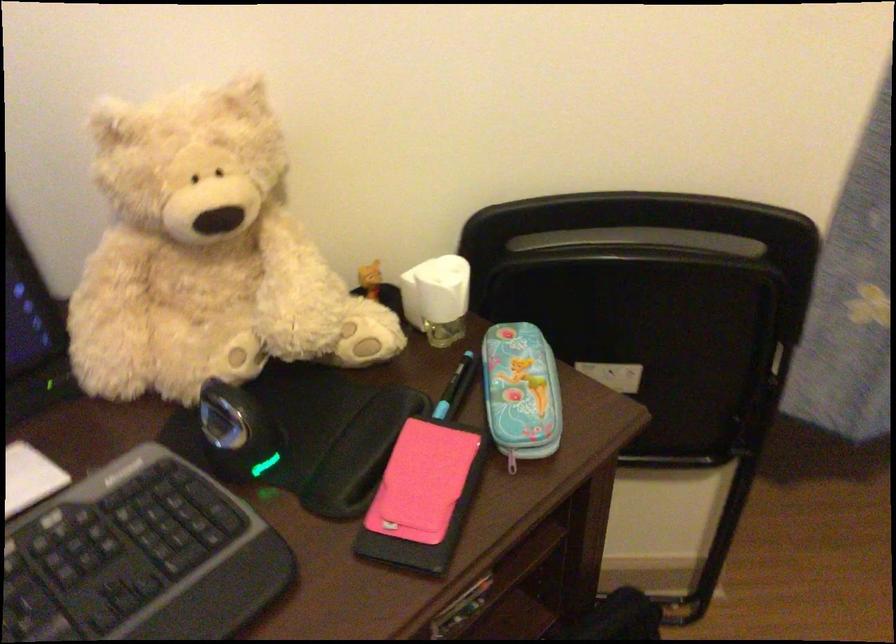
Image resolution: width=896 pixels, height=644 pixels. What do you see at coordinates (684, 435) in the screenshot?
I see `the chair sitting surface` at bounding box center [684, 435].